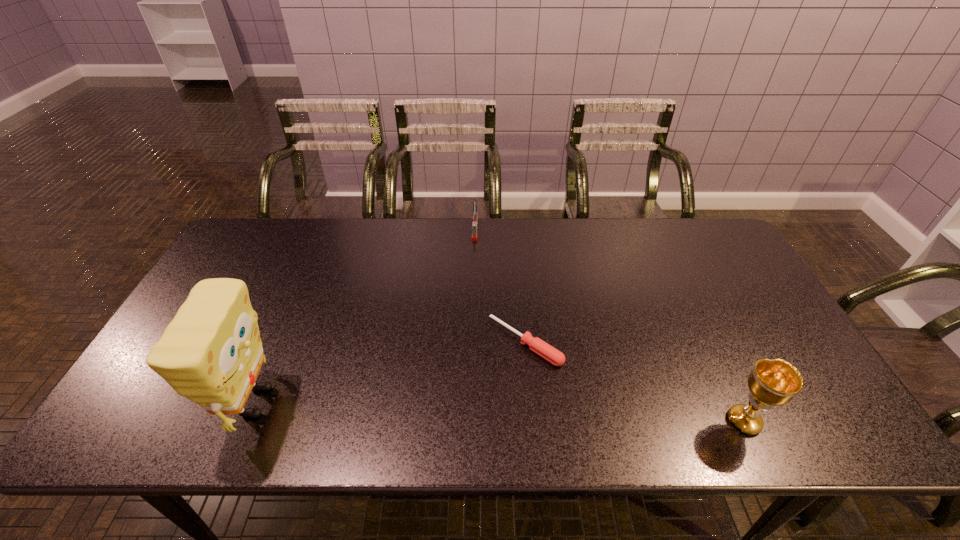
In the image, there is a desktop. At what (x,y) coordinates should I click in order to perform the action: click on blank space at the far left corner. Please return your answer as a coordinate pair (x, y). The width and height of the screenshot is (960, 540). Looking at the image, I should click on (252, 254).

Locate an element on the screen. The height and width of the screenshot is (540, 960). free space at the far right corner of the desktop is located at coordinates (699, 258).

The image size is (960, 540). In order to click on vacant area that lies between the leftmost object and the farthest object in this screenshot , I will do `click(365, 316)`.

I want to click on blank region between the third shortest object and the second shortest object, so click(610, 326).

This screenshot has width=960, height=540. I want to click on free space between the tallest object and the second shortest object, so click(x=365, y=316).

I want to click on vacant area between the second tallest object and the second object from right to left, so click(635, 382).

I want to click on empty space that is in between the tallest object and the second object from left to right, so click(x=365, y=316).

This screenshot has height=540, width=960. Find the location of `free space between the sponge and the stapler`. free space between the sponge and the stapler is located at coordinates (365, 316).

Where is `free point between the third shortest object and the leftmost object`? The width and height of the screenshot is (960, 540). free point between the third shortest object and the leftmost object is located at coordinates (499, 412).

The width and height of the screenshot is (960, 540). In order to click on free space between the third object from left to right and the chalice in this screenshot , I will do `click(635, 382)`.